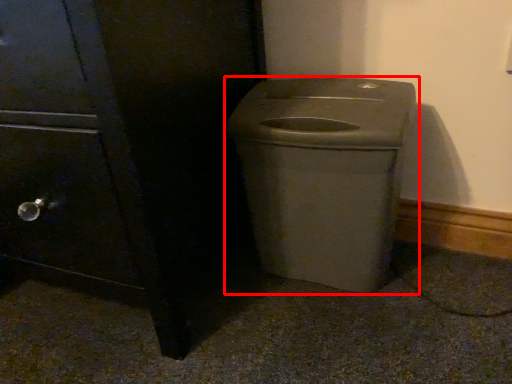
Question: From the image's perspective, where is waste container (annotated by the red box) located in relation to side cabinet in the image?

Choices:
 (A) below
 (B) above

Answer: (A)